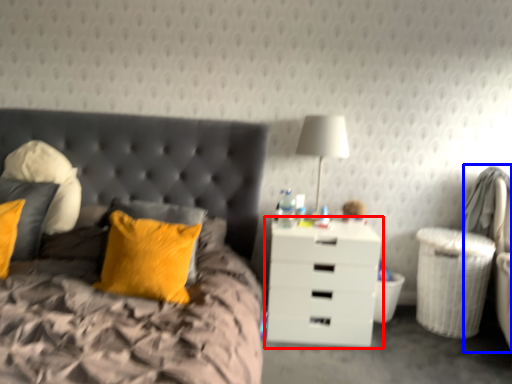
Question: Which object is closer to the camera taking this photo, nightstand (highlighted by a red box) or swivel chair (highlighted by a blue box)?

Choices:
 (A) nightstand
 (B) swivel chair

Answer: (B)